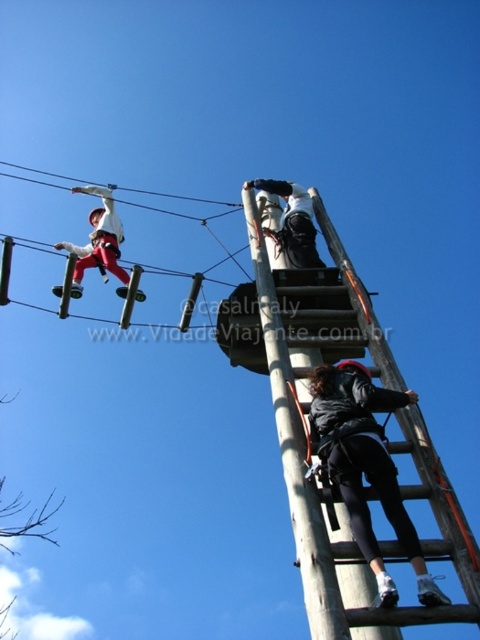
Consider the image. Does white matte helmet at upper center appear on the left side of white rope at upper left?

In fact, white matte helmet at upper center is to the right of white rope at upper left.

Is white matte helmet at upper center shorter than white rope at upper left?

Yes.

The height and width of the screenshot is (640, 480). What are the coordinates of `white matte helmet at upper center` in the screenshot? It's located at (291, 221).

In the scene shown: Is wooden pole at upper center taller than white matte helmet at upper center?

Yes, wooden pole at upper center is taller than white matte helmet at upper center.

How far apart are wooden pole at upper center and white matte helmet at upper center?

A distance of 7.37 meters exists between wooden pole at upper center and white matte helmet at upper center.

Which is behind, point (288, 419) or point (300, 221)?

Point (300, 221)

At what (x,y) coordinates should I click in order to perform the action: click on wooden pole at upper center. Please return your answer as a coordinate pair (x, y). The image size is (480, 640). Looking at the image, I should click on (294, 435).

Is point (370, 349) closer to camera compared to point (11, 176)?

Yes, it is in front of point (11, 176).

Can you confirm if wooden ladder at center is bigger than white rope at upper left?

Actually, wooden ladder at center might be smaller than white rope at upper left.

Describe the element at coordinates (314, 486) in the screenshot. I see `wooden ladder at center` at that location.

You are a GUI agent. You are given a task and a screenshot of the screen. Output one action in this format:
    pyautogui.click(x=<x>, y=<y>)
    Task: Click on the wooden ladder at center
    The width and height of the screenshot is (480, 640).
    Given the screenshot: What is the action you would take?
    pyautogui.click(x=314, y=486)